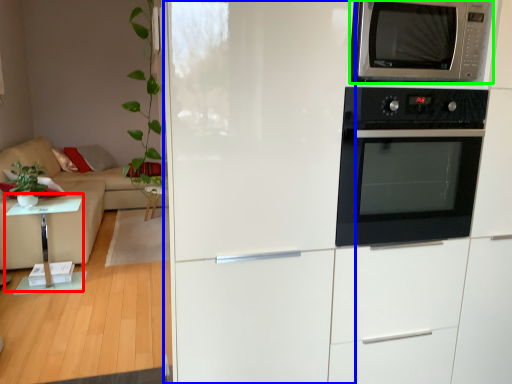
Question: Based on their relative distances, which object is nearer to table (highlighted by a red box)? Choose from fridge (highlighted by a blue box) and microwave oven (highlighted by a green box).

Choices:
 (A) fridge
 (B) microwave oven

Answer: (A)